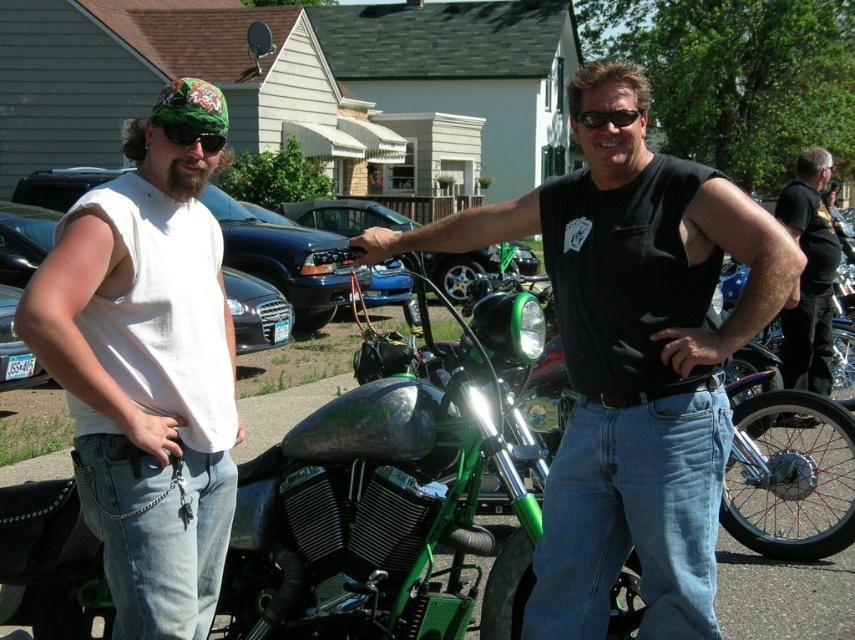
Question: Is black sleeveless shirt at center wider than white cotton tank top at left?

Choices:
 (A) yes
 (B) no

Answer: (A)

Question: Can you confirm if black leather jacket at upper right is smaller than green matte/glossy goggles at upper left?

Choices:
 (A) yes
 (B) no

Answer: (B)

Question: Does black sleeveless shirt at center come in front of green matte/glossy goggles at upper left?

Choices:
 (A) yes
 (B) no

Answer: (A)

Question: Based on their relative distances, which object is farther from the white cotton tank top at left?

Choices:
 (A) black sleeveless shirt at center
 (B) black plastic sunglasses at upper center

Answer: (B)

Question: Which of the following is the farthest from the observer?

Choices:
 (A) white cotton tank top at left
 (B) black plastic sunglasses at upper center
 (C) green matte/glossy goggles at upper left

Answer: (B)

Question: Which point is closer to the camera taking this photo?

Choices:
 (A) (823, 269)
 (B) (711, 413)
 (C) (599, 120)
 (D) (155, 328)

Answer: (D)